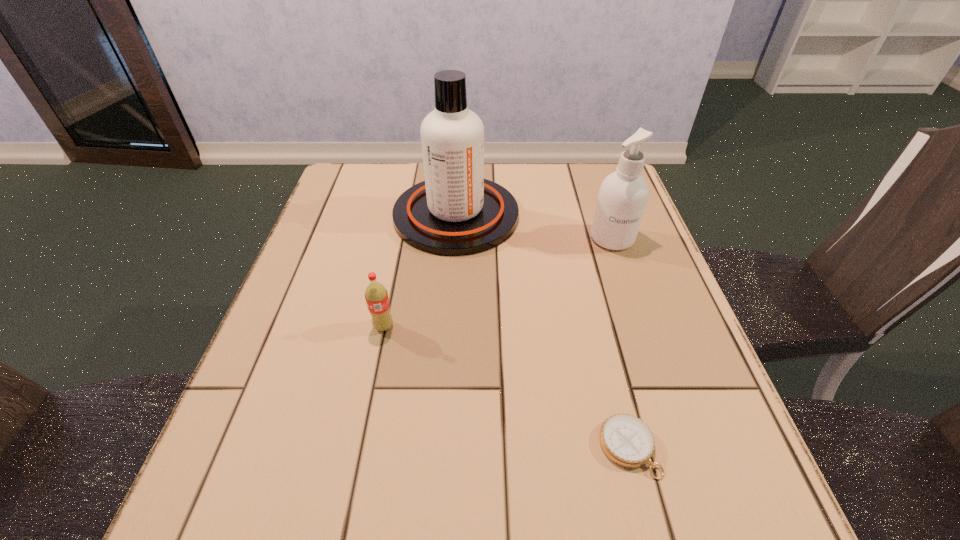
You are a GUI agent. You are given a task and a screenshot of the screen. Output one action in this format:
    pyautogui.click(x=<x>, y=<y>)
    Task: Click on the blank space at the right edge of the desktop
    
    Given the screenshot: What is the action you would take?
    pyautogui.click(x=621, y=323)

Locate an element on the screen. The image size is (960, 540). blank space at the far left corner is located at coordinates (354, 174).

Where is `blank space at the far right corner of the desktop`? The image size is (960, 540). blank space at the far right corner of the desktop is located at coordinates (584, 184).

Image resolution: width=960 pixels, height=540 pixels. Find the location of `vacant point located between the tallest object and the shorter cleansing agent`. vacant point located between the tallest object and the shorter cleansing agent is located at coordinates (534, 227).

At what (x,y) coordinates should I click in order to perform the action: click on empty location between the nearest object and the second shortest object. Please return your answer as a coordinate pair (x, y). The width and height of the screenshot is (960, 540). Looking at the image, I should click on (506, 387).

This screenshot has height=540, width=960. Find the location of `unoccupied area between the shorter cleansing agent and the taller cleansing agent`. unoccupied area between the shorter cleansing agent and the taller cleansing agent is located at coordinates (534, 227).

Identify the location of free area in between the shorter cleansing agent and the left cleansing agent. (534, 227).

You are a GUI agent. You are given a task and a screenshot of the screen. Output one action in this format:
    pyautogui.click(x=<x>, y=<y>)
    Task: Click on the free space between the taller cleansing agent and the second tallest object
    The width and height of the screenshot is (960, 540).
    Given the screenshot: What is the action you would take?
    pyautogui.click(x=534, y=227)

This screenshot has width=960, height=540. What are the coordinates of `blank region between the tallest object and the second shortest object` in the screenshot? It's located at pos(420,271).

This screenshot has height=540, width=960. I want to click on free spot between the shorter cleansing agent and the second nearest object, so click(498, 282).